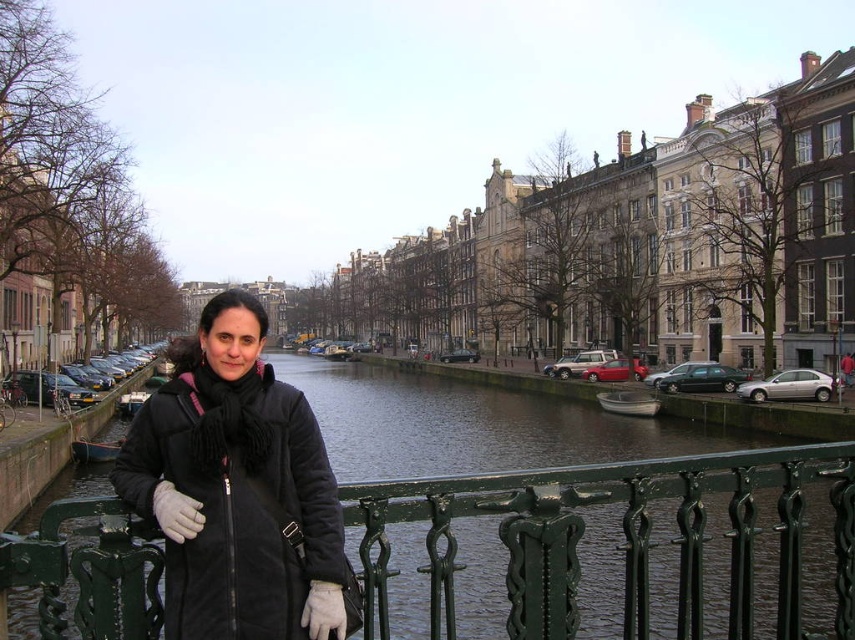
Question: Can you confirm if green painted metal railing at center is thinner than black suede coat at center?

Choices:
 (A) yes
 (B) no

Answer: (B)

Question: Which of the following is the farthest from the observer?

Choices:
 (A) (295, 460)
 (B) (68, 541)

Answer: (B)

Question: Does green painted metal railing at center have a lesser width compared to black suede coat at center?

Choices:
 (A) no
 (B) yes

Answer: (A)

Question: Which object is closer to the camera taking this photo?

Choices:
 (A) green painted metal railing at center
 (B) black suede coat at center

Answer: (A)

Question: Is green painted metal railing at center bigger than black suede coat at center?

Choices:
 (A) yes
 (B) no

Answer: (A)

Question: Which point is closer to the camera?

Choices:
 (A) (266, 508)
 (B) (46, 525)

Answer: (B)